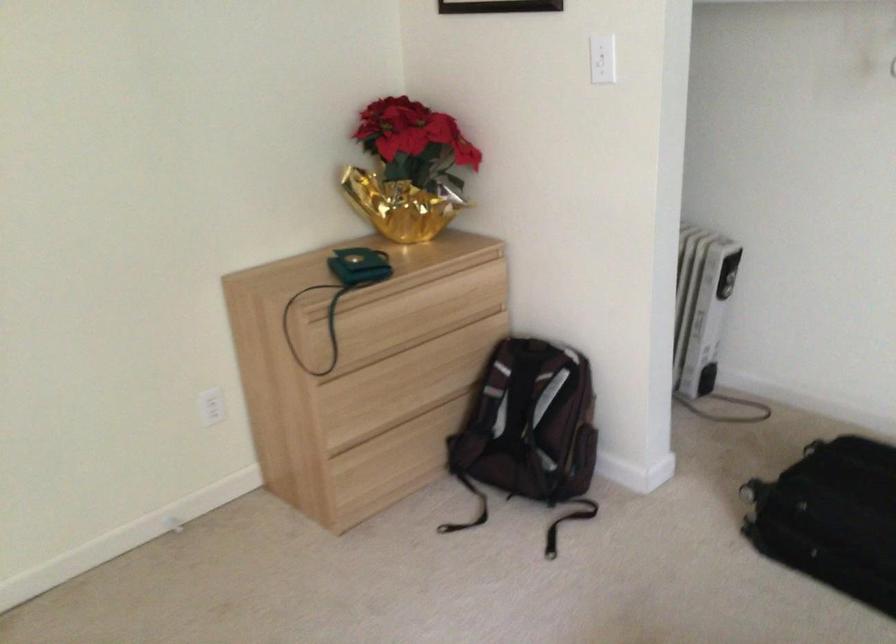
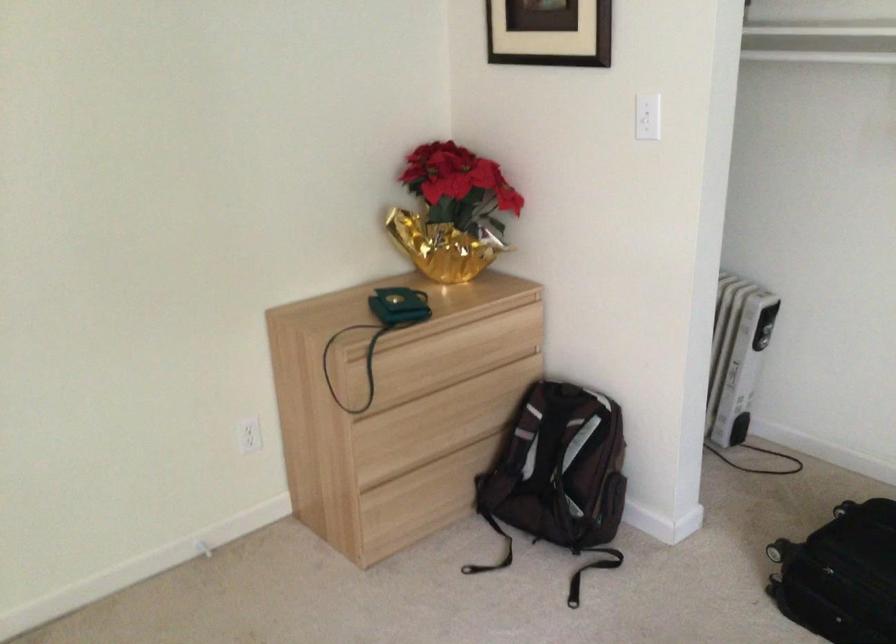
The point at [530,422] is marked in the first image. Where is the corresponding point in the second image?

(558, 468)